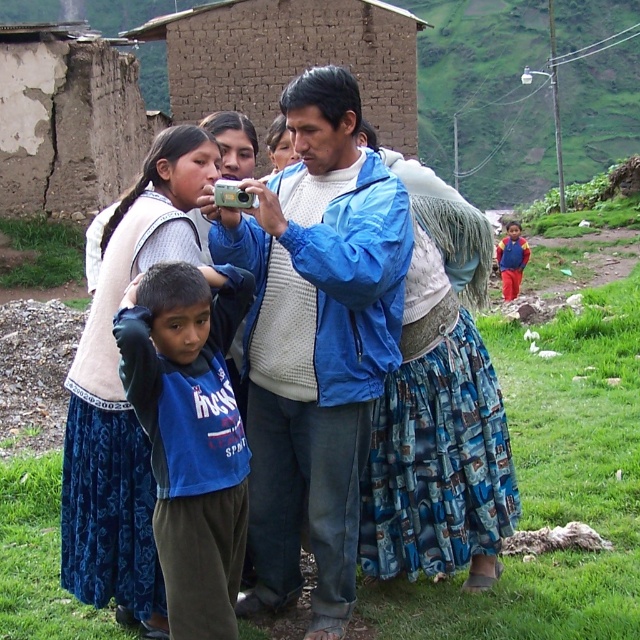
You are a photographer trying to capture a family portrait. You notice two blue shirts in the scene. Which one is closer to you, the photographer, the blue fabric shirt at center or the blue cotton shirt at center?

The blue fabric shirt at center is closer to you than the blue cotton shirt at center.

Based on the photo, you are a photographer trying to capture a clear shot of the blue matte jacket at center and the white knit sweater at center. Which one will appear larger in your photo?

The blue matte jacket at center will appear larger in the photo because it is closer to the viewer than the white knit sweater at center.